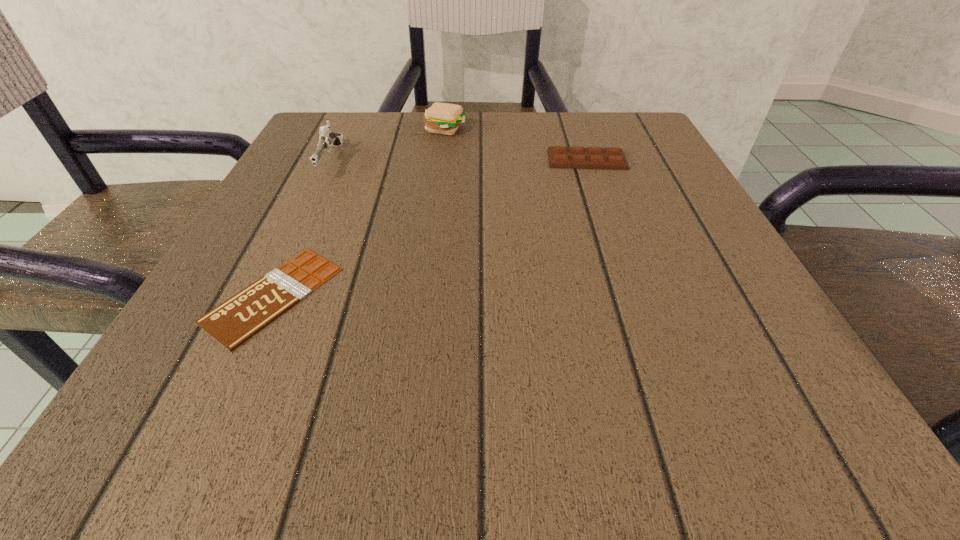
This screenshot has height=540, width=960. I want to click on free spot located on the right of the shortest object, so click(x=485, y=295).

Identify the location of gun that is at the far edge. (327, 138).

Where is `patty at the far edge`? Image resolution: width=960 pixels, height=540 pixels. patty at the far edge is located at coordinates (443, 118).

Identify the location of chocolate bar positioned at the far edge. pyautogui.click(x=612, y=158).

You are a GUI agent. You are given a task and a screenshot of the screen. Output one action in this format:
    pyautogui.click(x=<x>, y=<y>)
    Task: Click on the gun at the left edge
    This screenshot has width=960, height=540.
    Given the screenshot: What is the action you would take?
    327,138

The image size is (960, 540). Identify the location of chocolate bar situated at the left edge. (237, 319).

Identify the location of object that is positioned at the right edge. (612, 158).

You are a GUI agent. You are given a task and a screenshot of the screen. Output one action in this format:
    pyautogui.click(x=<x>, y=<y>)
    Task: Click on the object that is at the far left corner
    This screenshot has height=540, width=960.
    Given the screenshot: What is the action you would take?
    pyautogui.click(x=327, y=138)

You are a GUI agent. You are given a task and a screenshot of the screen. Output one action in this format:
    pyautogui.click(x=<x>, y=<y>)
    Task: Click on the object situated at the far right corner
    
    Given the screenshot: What is the action you would take?
    pyautogui.click(x=612, y=158)

In the image, there is a desktop. At what (x,y) coordinates should I click in order to perform the action: click on free space at the far edge. Please return your answer as a coordinate pair (x, y). The height and width of the screenshot is (540, 960). Looking at the image, I should click on (376, 155).